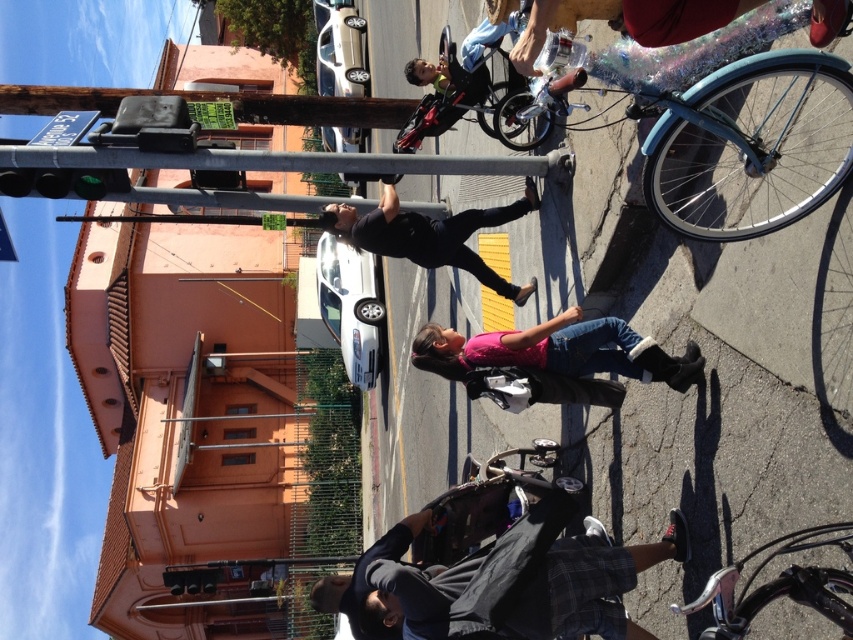
Can you confirm if shiny blue bicycle at right is thinner than black matte pants at center?

Yes.

What are the coordinates of `shiny blue bicycle at right` in the screenshot? It's located at (746, 141).

Between point (734, 74) and point (850, 636), which one is positioned in front?

Point (850, 636)

Which is in front, point (671, 179) or point (821, 611)?

Point (821, 611) is more forward.

This screenshot has height=640, width=853. What are the coordinates of `shiny blue bicycle at right` in the screenshot? It's located at (746, 141).

Based on the photo, can you confirm if pink matte shirt at center is taller than shiny metallic bicycle at center?

No, pink matte shirt at center is not taller than shiny metallic bicycle at center.

Is point (666, 362) behind point (444, 97)?

No, (666, 362) is closer to viewer.

Which is in front, point (688, 340) or point (450, 97)?

Point (688, 340) is in front.

This screenshot has height=640, width=853. Identify the location of pink matte shirt at center. (556, 349).